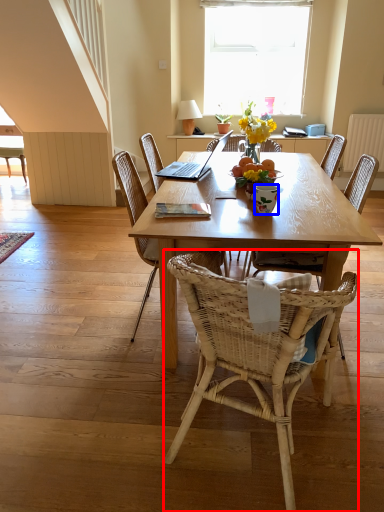
Question: Among these objects, which one is farthest to the camera, chair (highlighted by a red box) or coffee cup (highlighted by a blue box)?

Choices:
 (A) chair
 (B) coffee cup

Answer: (B)